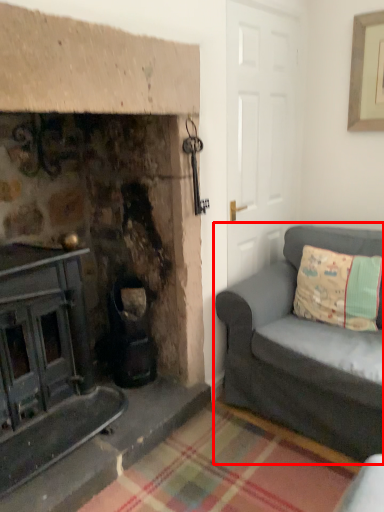
Question: Where is studio couch (annotated by the red box) located in relation to pillow in the image?

Choices:
 (A) right
 (B) left

Answer: (B)